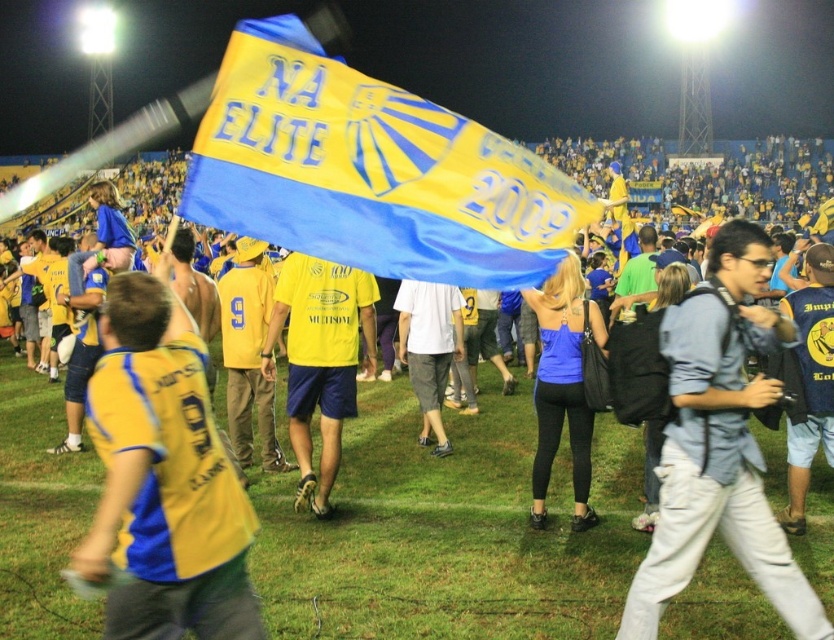
Question: Which object appears closest to the camera in this image?

Choices:
 (A) yellow matte shirt at center
 (B) yellow jersey at center

Answer: (B)

Question: Is light blue denim shirt at center smaller than yellow matte shirt at center?

Choices:
 (A) yes
 (B) no

Answer: (A)

Question: Where is yellow fabric flag at center located in relation to yellow jersey at center in the image?

Choices:
 (A) above
 (B) below

Answer: (A)

Question: Does yellow jersey at center appear on the left side of blue matte tank top at center?

Choices:
 (A) yes
 (B) no

Answer: (A)

Question: Which point is farther to the camera?

Choices:
 (A) yellow matte shirt at center
 (B) blue matte tank top at center
 (C) yellow jersey at center
 (D) light blue denim shirt at center

Answer: (A)

Question: Which of the following is the farthest from the observer?

Choices:
 (A) yellow jersey at center
 (B) blue matte tank top at center
 (C) yellow matte shirt at center
 (D) yellow fabric flag at center

Answer: (C)